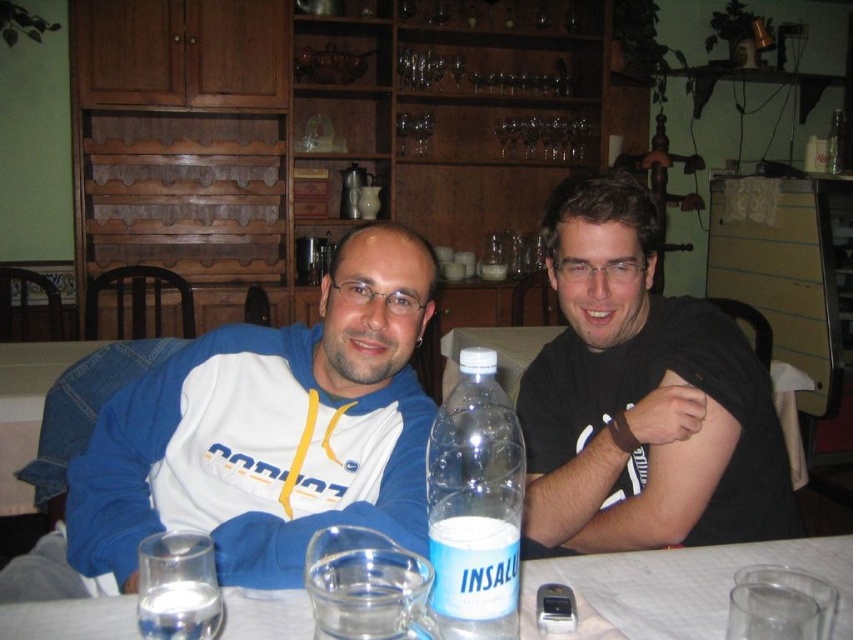
You are a photographer standing 3 feet away from the table. You want to take a closeup photo of the clear glass water at lower left without the black matte shirt at right appearing in the frame. Is this possible given their distance?

The black matte shirt at right is 27.87 inches away from clear glass water at lower left. Since you are standing 3 feet away from the table, which is 36 inches, the distance between the two objects is less than your distance. Therefore, adjusting the camera angle slightly could allow you to capture the clear glass water at lower left without the black matte shirt at right in the frame.

You are a delivery person who needs to place a new water bottle that is 12 inches long on the table. The table has the clear plastic bottle at center and the clear glass water at lower left. Can you fit the new bottle between them without moving the existing items?

The distance between the clear plastic bottle at center and the clear glass water at lower left is 11.09 inches. Since the new bottle is 12 inches long, it cannot fit in the space between them without moving existing items.